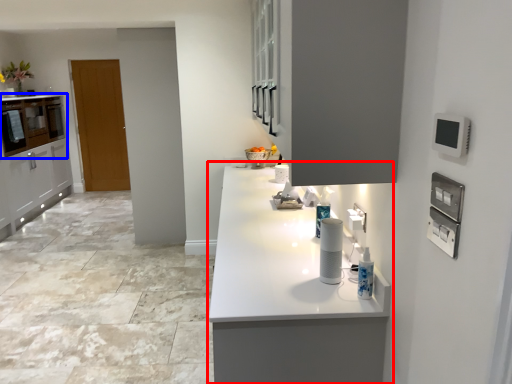
Question: Which object appears farthest to the camera in this image, countertop (highlighted by a red box) or cabinetry (highlighted by a blue box)?

Choices:
 (A) countertop
 (B) cabinetry

Answer: (B)